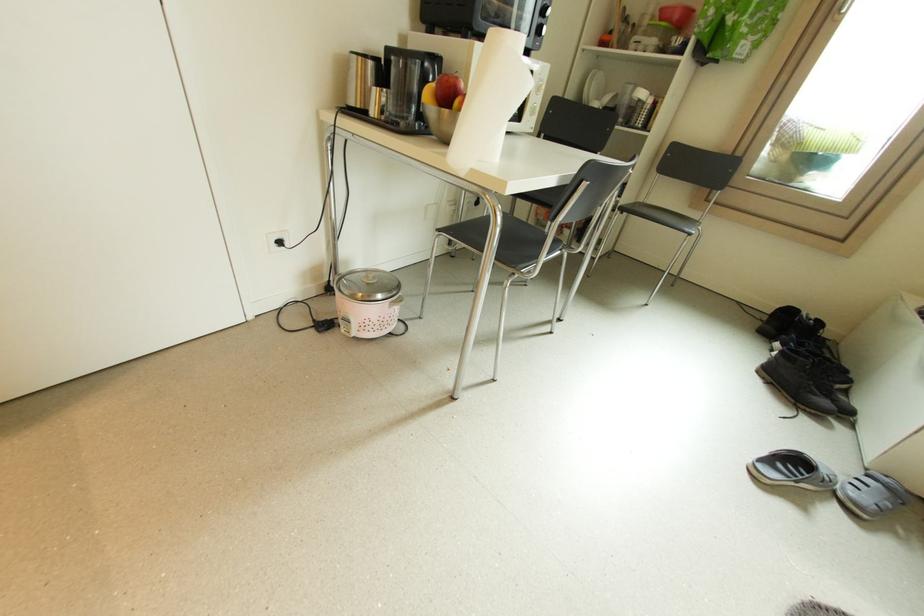
I want to click on black shoe, so click(795, 382).